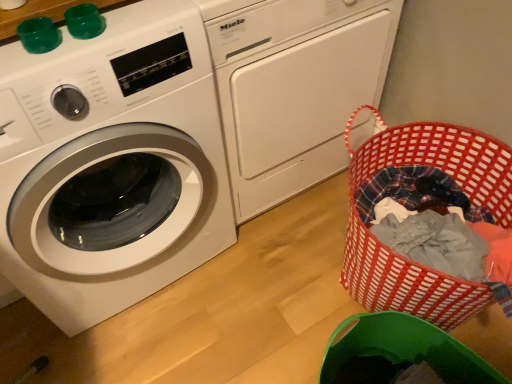
The width and height of the screenshot is (512, 384). I want to click on white glossy washing machine at left, the second washing machine from the right, so click(x=111, y=164).

Is white glossy washing machine at left, the first washing machine when ordered from right to left, completely or partially inside white glossy washing machine at left, which ranks as the first washing machine in left-to-right order?

No, white glossy washing machine at left, which ranks as the first washing machine in left-to-right order, does not contain white glossy washing machine at left, the first washing machine when ordered from right to left.

Is white glossy washing machine at left, which ranks as the first washing machine in left-to-right order, not close to white glossy washing machine at left, which is the second washing machine from left to right?

No, there isn't a large distance between white glossy washing machine at left, which ranks as the first washing machine in left-to-right order, and white glossy washing machine at left, which is the second washing machine from left to right.

The height and width of the screenshot is (384, 512). I want to click on washing machine above the white glossy washing machine at left, which is the second washing machine from left to right (from a real-world perspective), so click(x=111, y=164).

Is white glossy washing machine at left, which ranks as the first washing machine in left-to-right order, aimed at white glossy washing machine at left, the first washing machine when ordered from right to left?

No, white glossy washing machine at left, which ranks as the first washing machine in left-to-right order, does not turn towards white glossy washing machine at left, the first washing machine when ordered from right to left.

Considering the positions of point (124, 280) and point (386, 278), is point (124, 280) closer or farther from the camera than point (386, 278)?

Point (124, 280).

Could you measure the distance between white glossy washing machine at left, which ranks as the first washing machine in left-to-right order, and red woven laundry basket at lower right?

white glossy washing machine at left, which ranks as the first washing machine in left-to-right order, is 23.19 inches from red woven laundry basket at lower right.

From a real-world perspective, relative to red woven laundry basket at lower right, is white glossy washing machine at left, the second washing machine from the right, vertically above or below?

white glossy washing machine at left, the second washing machine from the right, is above red woven laundry basket at lower right.

Can you confirm if white glossy washing machine at left, which ranks as the first washing machine in left-to-right order, is bigger than red woven laundry basket at lower right?

Yes, white glossy washing machine at left, which ranks as the first washing machine in left-to-right order, is bigger than red woven laundry basket at lower right.

Who is smaller, red woven laundry basket at lower right or white glossy washing machine at left, the first washing machine when ordered from right to left?

red woven laundry basket at lower right.

Is point (364, 229) farther from camera compared to point (330, 69)?

No, it is in front of (330, 69).

Is red woven laundry basket at lower right thinner than white glossy washing machine at left, which is the second washing machine from left to right?

Correct, the width of red woven laundry basket at lower right is less than that of white glossy washing machine at left, which is the second washing machine from left to right.

From the picture: Is red woven laundry basket at lower right aimed at white glossy washing machine at left, which is the second washing machine from left to right?

No, red woven laundry basket at lower right is not aimed at white glossy washing machine at left, which is the second washing machine from left to right.

Which is behind, white glossy washing machine at left, the first washing machine when ordered from right to left, or white glossy washing machine at left, the second washing machine from the right?

white glossy washing machine at left, the first washing machine when ordered from right to left, is further away from the camera.

Which of these two, white glossy washing machine at left, which is the second washing machine from left to right, or white glossy washing machine at left, the second washing machine from the right, stands shorter?

Standing shorter between the two is white glossy washing machine at left, which is the second washing machine from left to right.

Is white glossy washing machine at left, which is the second washing machine from left to right, not close to white glossy washing machine at left, which ranks as the first washing machine in left-to-right order?

No, white glossy washing machine at left, which is the second washing machine from left to right, is not far away from white glossy washing machine at left, which ranks as the first washing machine in left-to-right order.

From a real-world perspective, is white glossy washing machine at left, the first washing machine when ordered from right to left, physically located above or below white glossy washing machine at left, the second washing machine from the right?

white glossy washing machine at left, the first washing machine when ordered from right to left, is below white glossy washing machine at left, the second washing machine from the right.

Does point (424, 298) lie behind point (181, 219)?

That is False.

In the image, is red woven laundry basket at lower right on the left side or the right side of white glossy washing machine at left, the second washing machine from the right?

Clearly, red woven laundry basket at lower right is on the right of white glossy washing machine at left, the second washing machine from the right, in the image.

Consider the image. Which object is further away from the camera taking this photo, red woven laundry basket at lower right or white glossy washing machine at left, the second washing machine from the right?

red woven laundry basket at lower right is more distant.

How different are the orientations of white glossy washing machine at left, which is the second washing machine from left to right, and red woven laundry basket at lower right in degrees?

There is a 92.6-degree angle between the facing directions of white glossy washing machine at left, which is the second washing machine from left to right, and red woven laundry basket at lower right.

Can you confirm if white glossy washing machine at left, the first washing machine when ordered from right to left, is shorter than red woven laundry basket at lower right?

In fact, white glossy washing machine at left, the first washing machine when ordered from right to left, may be taller than red woven laundry basket at lower right.

Can red woven laundry basket at lower right be found inside white glossy washing machine at left, which is the second washing machine from left to right?

No, red woven laundry basket at lower right is located outside of white glossy washing machine at left, which is the second washing machine from left to right.

From the image's perspective, is white glossy washing machine at left, the first washing machine when ordered from right to left, over red woven laundry basket at lower right?

Yes, from the image's perspective, white glossy washing machine at left, the first washing machine when ordered from right to left, is over red woven laundry basket at lower right.

At what (x,y) coordinates should I click in order to perform the action: click on washing machine above the white glossy washing machine at left, which is the second washing machine from left to right (from a real-world perspective). Please return your answer as a coordinate pair (x, y). The image size is (512, 384). Looking at the image, I should click on (111, 164).

This screenshot has width=512, height=384. In order to click on basket that is on the right side of white glossy washing machine at left, the second washing machine from the right in this screenshot , I will do `click(402, 258)`.

Estimate the real-world distances between objects in this image. Which object is further from red woven laundry basket at lower right, white glossy washing machine at left, the second washing machine from the right, or white glossy washing machine at left, the first washing machine when ordered from right to left?

white glossy washing machine at left, the second washing machine from the right, is positioned further to the anchor red woven laundry basket at lower right.

Based on their spatial positions, is red woven laundry basket at lower right or white glossy washing machine at left, the second washing machine from the right, closer to white glossy washing machine at left, which is the second washing machine from left to right?

Among the two, red woven laundry basket at lower right is located nearer to white glossy washing machine at left, which is the second washing machine from left to right.

Based on their spatial positions, is red woven laundry basket at lower right or white glossy washing machine at left, the first washing machine when ordered from right to left, closer to white glossy washing machine at left, the second washing machine from the right?

white glossy washing machine at left, the first washing machine when ordered from right to left, is closer to white glossy washing machine at left, the second washing machine from the right.

From the image, which object appears to be nearer to white glossy washing machine at left, the first washing machine when ordered from right to left, white glossy washing machine at left, which ranks as the first washing machine in left-to-right order, or red woven laundry basket at lower right?

red woven laundry basket at lower right is closer to white glossy washing machine at left, the first washing machine when ordered from right to left.

Based on their spatial positions, is white glossy washing machine at left, which is the second washing machine from left to right, or red woven laundry basket at lower right closer to white glossy washing machine at left, the second washing machine from the right?

white glossy washing machine at left, which is the second washing machine from left to right, lies closer to white glossy washing machine at left, the second washing machine from the right, than the other object.

When comparing their distances from red woven laundry basket at lower right, does white glossy washing machine at left, which is the second washing machine from left to right, or white glossy washing machine at left, which ranks as the first washing machine in left-to-right order, seem further?

white glossy washing machine at left, which ranks as the first washing machine in left-to-right order, is positioned further to the anchor red woven laundry basket at lower right.

The height and width of the screenshot is (384, 512). Find the location of `washing machine located between white glossy washing machine at left, which ranks as the first washing machine in left-to-right order, and red woven laundry basket at lower right in the left-right direction`. washing machine located between white glossy washing machine at left, which ranks as the first washing machine in left-to-right order, and red woven laundry basket at lower right in the left-right direction is located at coordinates (293, 87).